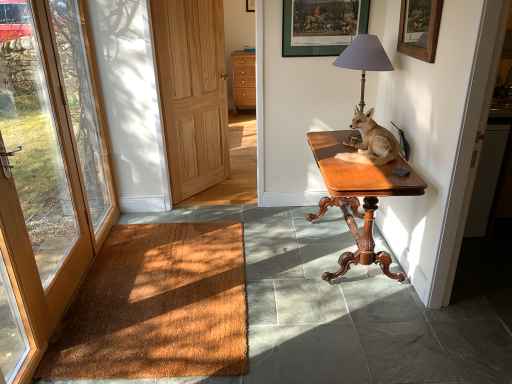
Question: Is green matte picture frame at upper center, placed as the second picture frame when sorted from front to back, situated inside brown wood door at left, which appears as the 2th door when viewed from the right, or outside?

Choices:
 (A) inside
 (B) outside

Answer: (B)

Question: Does point (345, 29) appear closer or farther from the camera than point (65, 172)?

Choices:
 (A) farther
 (B) closer

Answer: (A)

Question: Based on their relative distances, which object is nearer to the green matte picture frame at upper center, marked as the 2th picture frame in a right-to-left arrangement?

Choices:
 (A) light brown wood drawers at center
 (B) light brown fur at table right
 (C) brown coir mat at lower left
 (D) metallic gray lampshade at upper right
 (E) brown wood door at left, which appears as the 2th door when viewed from the right

Answer: (D)

Question: Based on their relative distances, which object is nearer to the mahogany wood desk at right?

Choices:
 (A) green matte picture frame at upper center, placed as the second picture frame when sorted from front to back
 (B) metallic gray lampshade at upper right
 (C) brown coir mat at lower left
 (D) wooden framed picture at upper right, the 1th picture frame positioned from the front
 (E) brown wood door at left, which appears as the 2th door when viewed from the right

Answer: (B)